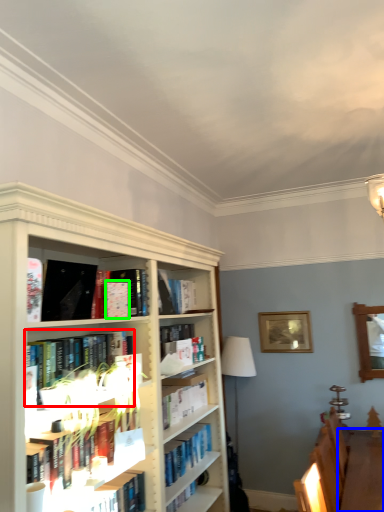
Question: Which is nearer to the book (highlighted by a red box)? table (highlighted by a blue box) or paperback book (highlighted by a green box).

Choices:
 (A) table
 (B) paperback book

Answer: (B)